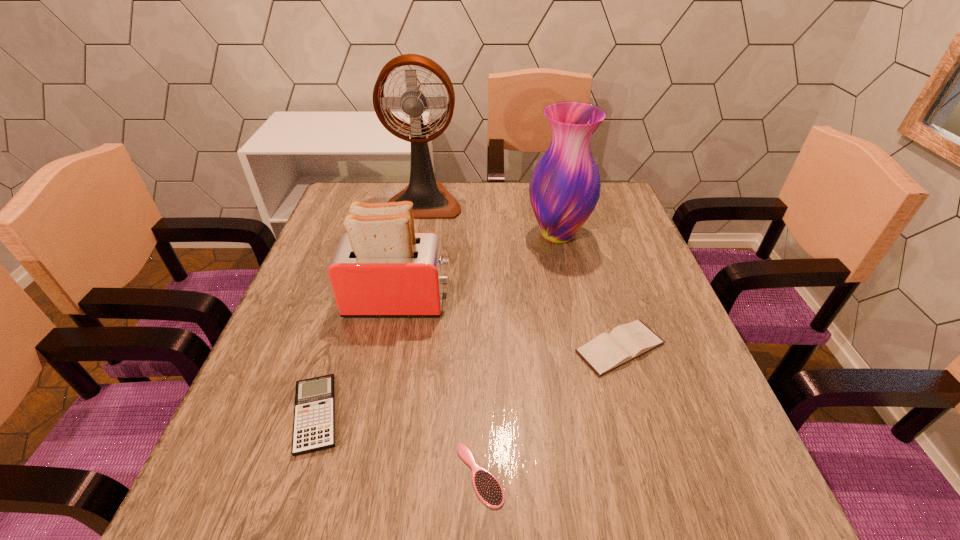
At what (x,y) coordinates should I click in order to perform the action: click on vacant space situated 0.360m on the front-facing side of the toaster. Please return your answer as a coordinate pair (x, y). Looking at the image, I should click on (609, 301).

You are a GUI agent. You are given a task and a screenshot of the screen. Output one action in this format:
    pyautogui.click(x=<x>, y=<y>)
    Task: Click on the free space located on the left of the diary
    Image resolution: width=960 pixels, height=540 pixels.
    Given the screenshot: What is the action you would take?
    pyautogui.click(x=394, y=348)

The width and height of the screenshot is (960, 540). Find the location of `free space located 0.160m on the right of the calculator`. free space located 0.160m on the right of the calculator is located at coordinates (434, 415).

You are a GUI agent. You are given a task and a screenshot of the screen. Output one action in this format:
    pyautogui.click(x=<x>, y=<y>)
    Task: Click on the free point located 0.340m on the left of the third object from right to left
    The height and width of the screenshot is (540, 960).
    Given the screenshot: What is the action you would take?
    pyautogui.click(x=245, y=475)

The image size is (960, 540). Find the location of `fan that is at the far edge`. fan that is at the far edge is located at coordinates (430, 199).

The image size is (960, 540). What are the coordinates of `vase located at the far edge` in the screenshot? It's located at coord(564,189).

Find the location of `object that is at the near edge`. object that is at the near edge is located at coordinates [x=487, y=487].

The width and height of the screenshot is (960, 540). Identify the location of fan positioned at the left edge. (430, 199).

Locate an element on the screen. toaster that is at the left edge is located at coordinates (381, 267).

At what (x,y) coordinates should I click in order to perform the action: click on calculator situated at the left edge. Please return your answer as a coordinate pair (x, y). The image size is (960, 540). Looking at the image, I should click on (314, 412).